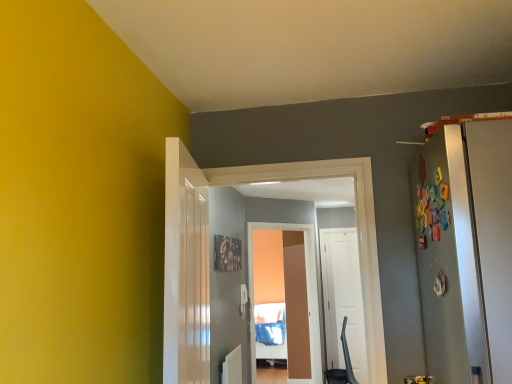
What is the approximate height of white glossy door at center, the 2th door from the left?

3.44 feet.

Find the location of a particular element. white glossy door at center, placed as the second door when sorted from front to back is located at coordinates (209, 251).

Measure the distance between point (x=333, y=336) and camera.

The distance of point (x=333, y=336) from camera is 5.17 meters.

I want to click on matte brown screen door at center, so click(308, 293).

Could you tell me if white glossy door at center, the third door from the back, is facing white glossy door at center, which is counted as the 2th door, starting from the back?

Yes, white glossy door at center, the third door from the back, is aimed at white glossy door at center, which is counted as the 2th door, starting from the back.

From a real-world perspective, is white glossy door at center, which is counted as the first door, starting from the front, beneath white glossy door at center, which is counted as the 2th door, starting from the back?

Yes, from a real-world perspective, white glossy door at center, which is counted as the first door, starting from the front, is beneath white glossy door at center, which is counted as the 2th door, starting from the back.

Which is in front, white glossy door at center, which is counted as the first door, starting from the front, or white glossy door at center, which is counted as the second door, starting from the right?

Positioned in front is white glossy door at center, which is counted as the first door, starting from the front.

Which of these two, white glossy door at center, the third door from the back, or white glossy door at center, placed as the second door when sorted from front to back, stands taller?

Standing taller between the two is white glossy door at center, placed as the second door when sorted from front to back.

Considering the points (184, 263) and (195, 252), which point is in front, point (184, 263) or point (195, 252)?

Positioned in front is point (184, 263).

In the scene shown: Does white glossy door at center, placed as the second door when sorted from front to back, contain white glossy door at center, which is counted as the first door, starting from the front?

That's incorrect, white glossy door at center, which is counted as the first door, starting from the front, is not inside white glossy door at center, placed as the second door when sorted from front to back.

From a real-world perspective, is white glossy door at center, which is counted as the second door, starting from the right, physically located above or below white glossy door at center, the 1th door positioned from the left?

white glossy door at center, which is counted as the second door, starting from the right, is situated higher than white glossy door at center, the 1th door positioned from the left, in the real world.

Would you say white glossy door at center, which is counted as the second door, starting from the right, is a long distance from white glossy door at center, which is counted as the first door, starting from the front?

That's not correct — white glossy door at center, which is counted as the second door, starting from the right, is a little close to white glossy door at center, which is counted as the first door, starting from the front.

From a real-world perspective, does white glossy door at center, the third door from the back, stand above white matte door at center, the 3th door positioned from the left?

Yes, from a real-world perspective, white glossy door at center, the third door from the back, is on top of white matte door at center, the 3th door positioned from the left.

Is white glossy door at center, arranged as the third door when viewed from the right, oriented towards white matte door at center, the 1th door positioned from the back?

No, white glossy door at center, arranged as the third door when viewed from the right, is not oriented towards white matte door at center, the 1th door positioned from the back.

Locate an element on the screen. the 2nd door counting from the left of the white matte door at center, the 3th door positioned from the left is located at coordinates (186, 269).

Is point (190, 319) closer or farther from the camera than point (346, 279)?

Point (190, 319) is closer to the camera than point (346, 279).

Is matte brown screen door at center located within white glossy door at center, the 2th door from the left?

No, matte brown screen door at center is not inside white glossy door at center, the 2th door from the left.

From the image's perspective, which one is positioned lower, white glossy door at center, which is counted as the second door, starting from the right, or matte brown screen door at center?

From the image's view, matte brown screen door at center is below.

Is white glossy door at center, which is counted as the 2th door, starting from the back, taller than matte brown screen door at center?

No.

Image resolution: width=512 pixels, height=384 pixels. I want to click on door that is the 2nd object to the left of the matte brown screen door at center, starting at the anchor, so click(x=186, y=269).

Is white glossy door at center, arranged as the third door when viewed from the right, placed right next to matte brown screen door at center?

No, white glossy door at center, arranged as the third door when viewed from the right, is not making contact with matte brown screen door at center.

Is point (178, 164) positioned behind point (319, 369)?

No, it is in front of (319, 369).

Is white matte door at center, the 1th door positioned from the back, completely or partially inside white glossy door at center, which is counted as the 2th door, starting from the back?

No, white matte door at center, the 1th door positioned from the back, is not inside white glossy door at center, which is counted as the 2th door, starting from the back.

Who is taller, white glossy door at center, which is counted as the 2th door, starting from the back, or white matte door at center, the 1th door in the right-to-left sequence?

white matte door at center, the 1th door in the right-to-left sequence.

The height and width of the screenshot is (384, 512). I want to click on door on the right of white glossy door at center, which is counted as the second door, starting from the right, so click(x=343, y=300).

Is point (179, 201) closer to viewer compared to point (354, 322)?

That is True.

Is white matte door at center, the 1th door in the right-to-left sequence, turned away from white glossy door at center, the 2th door from the left?

No.

Between point (342, 284) and point (166, 253), which one is positioned behind?

Positioned behind is point (342, 284).

From the image's perspective, who appears lower, white matte door at center, the 1th door positioned from the back, or white glossy door at center, which is counted as the 2th door, starting from the back?

white matte door at center, the 1th door positioned from the back, appears lower in the image.

Where is `door that is the 1st one when counting downward from the white glossy door at center, the third door from the back (from the image's perspective)`? This screenshot has width=512, height=384. door that is the 1st one when counting downward from the white glossy door at center, the third door from the back (from the image's perspective) is located at coordinates (209, 251).

This screenshot has width=512, height=384. What are the coordinates of `door that is in front of the white glossy door at center, placed as the second door when sorted from front to back` in the screenshot? It's located at (186, 269).

Based on their spatial positions, is white matte door at center, placed as the 3th door when sorted from front to back, or white glossy door at center, placed as the second door when sorted from front to back, closer to matte brown screen door at center?

white matte door at center, placed as the 3th door when sorted from front to back, lies closer to matte brown screen door at center than the other object.

Estimate the real-world distances between objects in this image. Which object is further from matte brown screen door at center, white glossy door at center, which is counted as the first door, starting from the front, or white matte door at center, the 3th door positioned from the left?

white glossy door at center, which is counted as the first door, starting from the front, is further to matte brown screen door at center.

Looking at the image, which one is located closer to matte brown screen door at center, white matte door at center, the 1th door in the right-to-left sequence, or white glossy door at center, which is counted as the first door, starting from the front?

Based on the image, white matte door at center, the 1th door in the right-to-left sequence, appears to be nearer to matte brown screen door at center.

Based on their spatial positions, is white matte door at center, the 3th door positioned from the left, or matte brown screen door at center further from white glossy door at center, the 2th door from the left?

matte brown screen door at center is positioned further to the anchor white glossy door at center, the 2th door from the left.

From the image, which object appears to be farther from white matte door at center, placed as the 3th door when sorted from front to back, white glossy door at center, which is counted as the first door, starting from the front, or matte brown screen door at center?

white glossy door at center, which is counted as the first door, starting from the front.

Based on their spatial positions, is white matte door at center, the 3th door positioned from the left, or white glossy door at center, which is counted as the second door, starting from the right, closer to white glossy door at center, the third door from the back?

The object closer to white glossy door at center, the third door from the back, is white glossy door at center, which is counted as the second door, starting from the right.

When comparing their distances from white glossy door at center, which is counted as the 2th door, starting from the back, does matte brown screen door at center or white glossy door at center, which is counted as the first door, starting from the front, seem closer?

Based on the image, white glossy door at center, which is counted as the first door, starting from the front, appears to be nearer to white glossy door at center, which is counted as the 2th door, starting from the back.

Based on their spatial positions, is white glossy door at center, the 2th door from the left, or matte brown screen door at center closer to white matte door at center, the 3th door positioned from the left?

matte brown screen door at center.

Where is `door located between white glossy door at center, the third door from the back, and white matte door at center, the 1th door positioned from the back, in the depth direction`? The image size is (512, 384). door located between white glossy door at center, the third door from the back, and white matte door at center, the 1th door positioned from the back, in the depth direction is located at coordinates (209, 251).

The height and width of the screenshot is (384, 512). Find the location of `screen door between white glossy door at center, which is counted as the 2th door, starting from the back, and white matte door at center, placed as the 3th door when sorted from front to back, along the z-axis`. screen door between white glossy door at center, which is counted as the 2th door, starting from the back, and white matte door at center, placed as the 3th door when sorted from front to back, along the z-axis is located at coordinates (308, 293).

This screenshot has height=384, width=512. In order to click on door located between white glossy door at center, the third door from the back, and matte brown screen door at center in the depth direction in this screenshot , I will do `click(209, 251)`.

Where is `screen door between white glossy door at center, the third door from the back, and white matte door at center, placed as the 3th door when sorted from front to back, from front to back`? The width and height of the screenshot is (512, 384). screen door between white glossy door at center, the third door from the back, and white matte door at center, placed as the 3th door when sorted from front to back, from front to back is located at coordinates (308, 293).